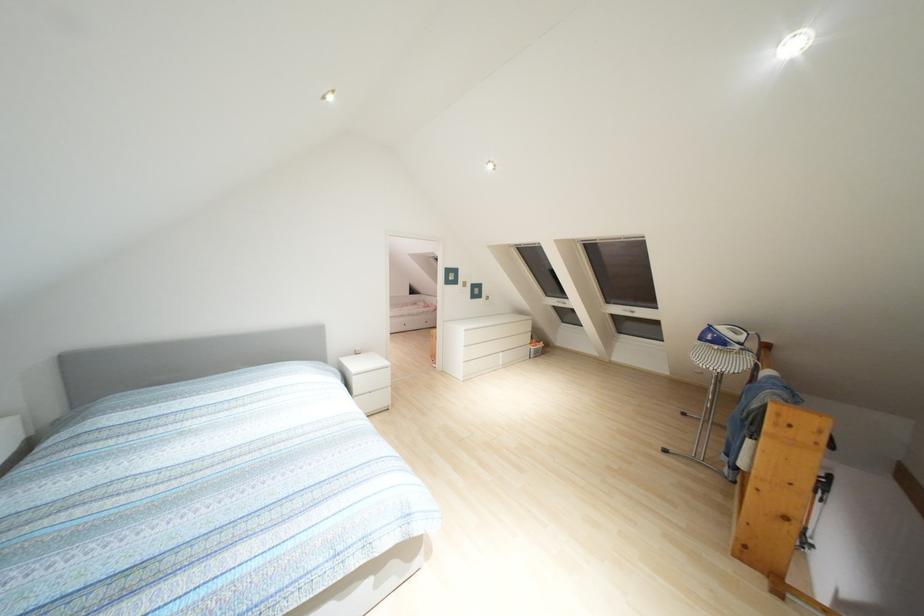
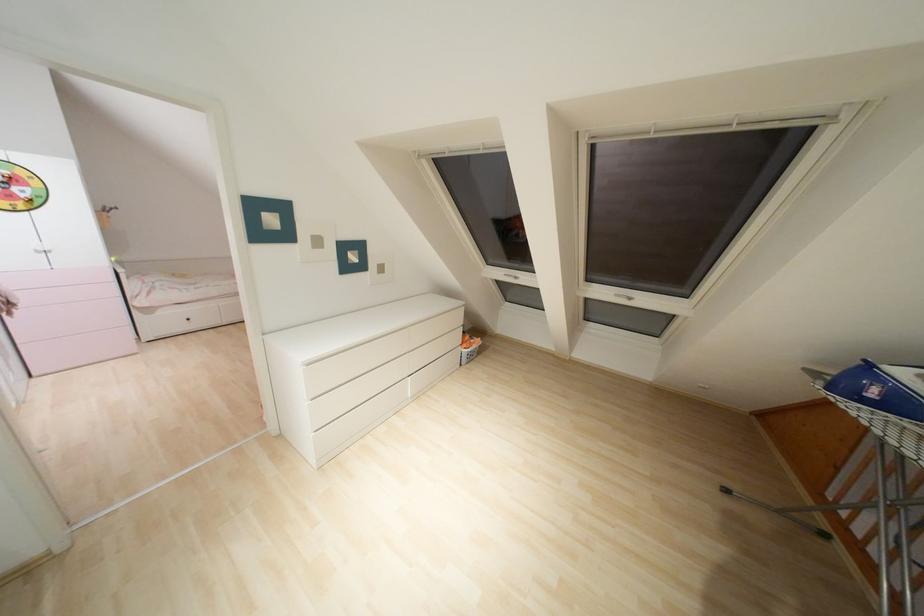
Locate, in the second image, the point that corresponds to (564,302) in the first image.

(515, 277)